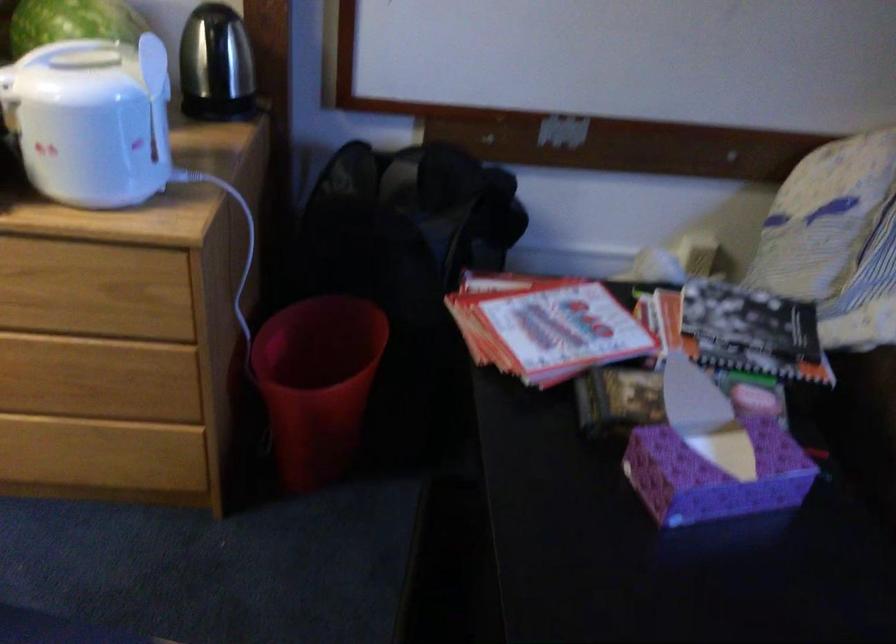
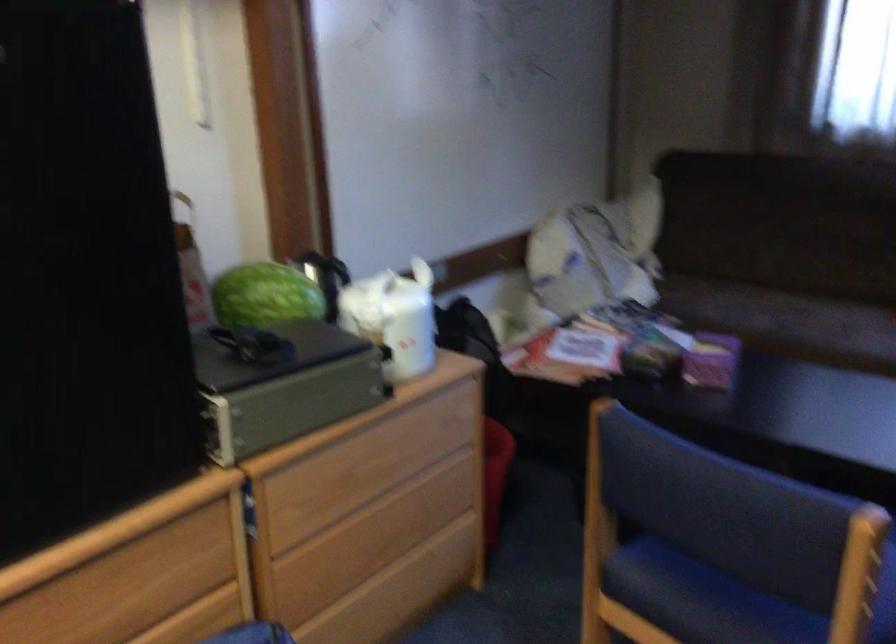
The point at [672,474] is marked in the first image. Where is the corresponding point in the second image?

(711, 361)